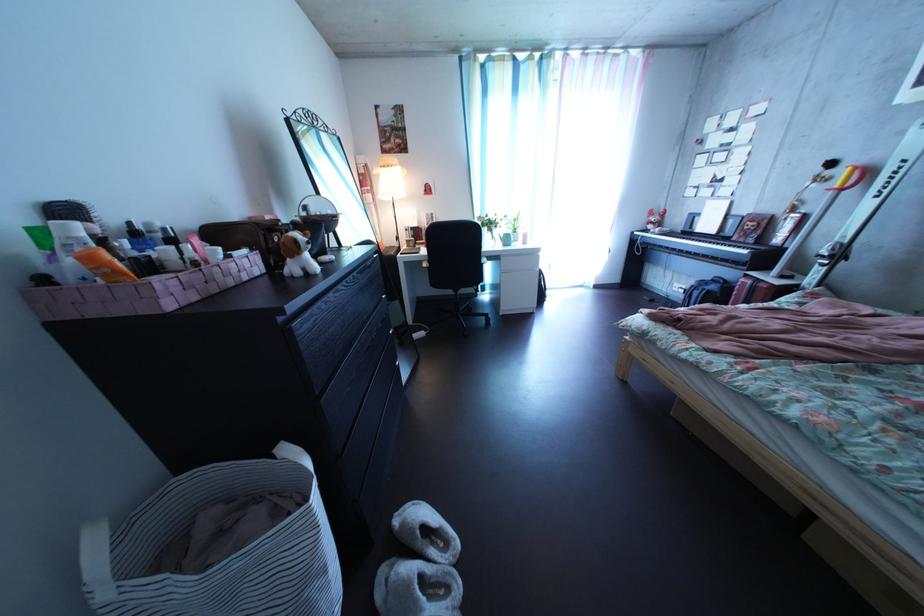
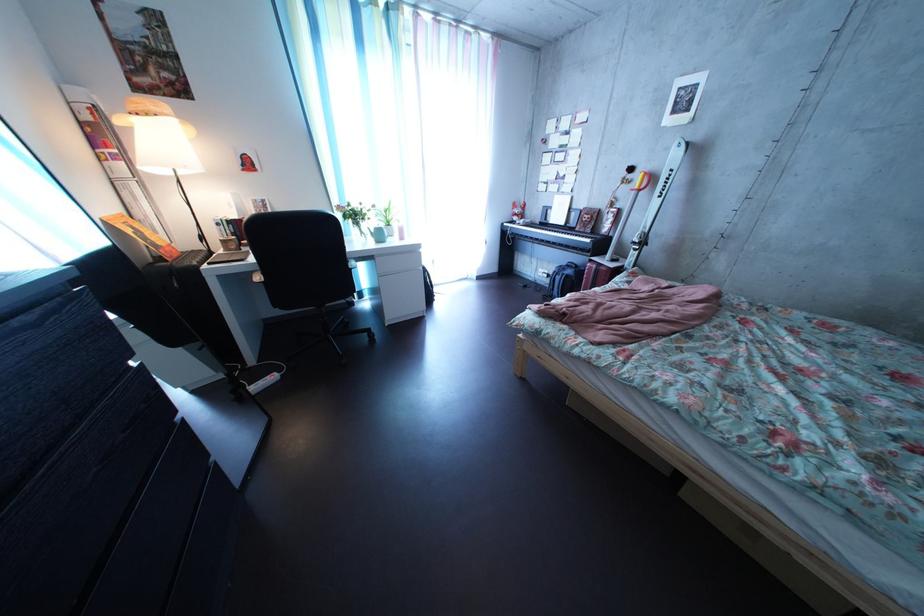
In the second image, find the point that corresponds to point 504,243 in the first image.

(371, 237)